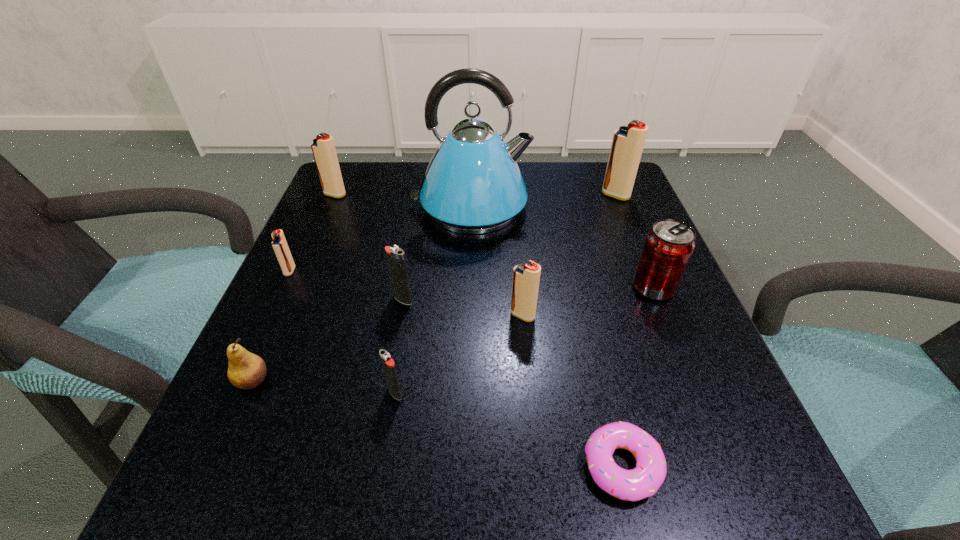
Image resolution: width=960 pixels, height=540 pixels. In the image, there is a desktop. What are the coordinates of `vacant region at the near left corner` in the screenshot? It's located at (193, 476).

The height and width of the screenshot is (540, 960). In the image, there is a desktop. Find the location of `vacant space at the far right corner`. vacant space at the far right corner is located at coordinates (583, 186).

Where is `unoccupied position between the tallest object and the second nearest red igniter`? This screenshot has width=960, height=540. unoccupied position between the tallest object and the second nearest red igniter is located at coordinates (380, 239).

Locate an element on the screen. This screenshot has height=540, width=960. empty location between the pop soda and the nearest igniter is located at coordinates coord(524,340).

The image size is (960, 540). I want to click on vacant space that's between the rightmost red igniter and the pop soda, so click(635, 241).

Locate an element on the screen. The image size is (960, 540). vacant area that lies between the smaller black igniter and the biggest red igniter is located at coordinates (505, 294).

Where is `free point between the fifth shortest igniter and the kettle`? This screenshot has width=960, height=540. free point between the fifth shortest igniter and the kettle is located at coordinates (402, 201).

You are a GUI agent. You are given a task and a screenshot of the screen. Output one action in this format:
    pyautogui.click(x=<x>, y=<y>)
    Task: Click on the vacant area that lies between the farther black igniter and the nearer black igniter
    This screenshot has height=540, width=960.
    Given the screenshot: What is the action you would take?
    pyautogui.click(x=398, y=346)

Where is `vacant region between the shortest object and the tallest object`? Image resolution: width=960 pixels, height=540 pixels. vacant region between the shortest object and the tallest object is located at coordinates point(546,336).

This screenshot has width=960, height=540. What are the coordinates of `unoccupied position between the smallest red igniter and the second biggest red igniter` in the screenshot? It's located at (312, 233).